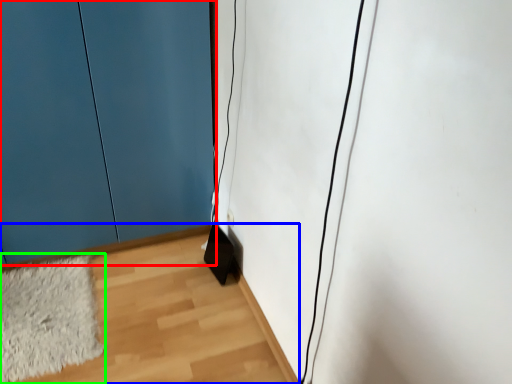
Question: Which object is the closest to the door (highlighted by a red box)? Choose among these: corridor (highlighted by a blue box) or mat (highlighted by a green box).

Choices:
 (A) corridor
 (B) mat

Answer: (B)